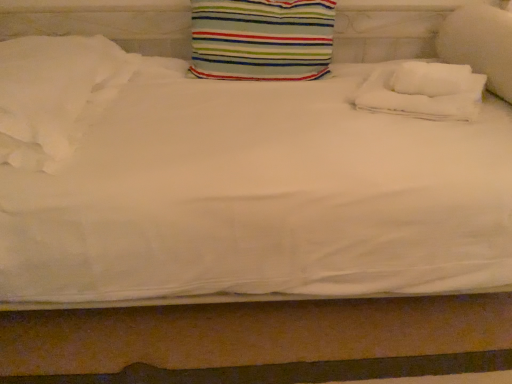
Question: Should I look upward or downward to see striped fabric pillow at center, the second pillow positioned from the left?

Choices:
 (A) down
 (B) up

Answer: (B)

Question: From the image's perspective, is white soft pillow at right, which is the 1th pillow in right-to-left order, located beneath white soft pillow at left, which is the fourth pillow in right-to-left order?

Choices:
 (A) yes
 (B) no

Answer: (B)

Question: Is white soft pillow at right, which is the 1th pillow in right-to-left order, closer to camera compared to white soft pillow at left, placed as the 1th pillow when sorted from left to right?

Choices:
 (A) no
 (B) yes

Answer: (A)

Question: Is white soft pillow at left, which is the fourth pillow in right-to-left order, inside white soft pillow at right, placed as the 4th pillow when sorted from left to right?

Choices:
 (A) yes
 (B) no

Answer: (B)

Question: Is white soft pillow at right, placed as the 4th pillow when sorted from left to right, positioned far away from white soft pillow at left, which is the fourth pillow in right-to-left order?

Choices:
 (A) no
 (B) yes

Answer: (B)

Question: Considering the relative sizes of white soft pillow at right, placed as the 4th pillow when sorted from left to right, and white soft pillow at left, placed as the 1th pillow when sorted from left to right, in the image provided, is white soft pillow at right, placed as the 4th pillow when sorted from left to right, bigger than white soft pillow at left, placed as the 1th pillow when sorted from left to right,?

Choices:
 (A) no
 (B) yes

Answer: (A)

Question: From a real-world perspective, is white soft pillow at right, placed as the 4th pillow when sorted from left to right, physically below white soft pillow at left, which is the fourth pillow in right-to-left order?

Choices:
 (A) no
 (B) yes

Answer: (A)

Question: From the image's perspective, is white soft pillow at left, which is the fourth pillow in right-to-left order, beneath white soft towel at upper right, the 3th pillow when ordered from left to right?

Choices:
 (A) yes
 (B) no

Answer: (A)

Question: Is white soft pillow at left, which is the fourth pillow in right-to-left order, not near white soft towel at upper right, the 3th pillow when ordered from left to right?

Choices:
 (A) yes
 (B) no

Answer: (B)

Question: Is white soft pillow at left, which is the fourth pillow in right-to-left order, next to white soft towel at upper right, the 3th pillow when ordered from left to right, and touching it?

Choices:
 (A) no
 (B) yes

Answer: (A)

Question: Can you confirm if white soft pillow at left, which is the fourth pillow in right-to-left order, is thinner than white soft towel at upper right, marked as the second pillow in a right-to-left arrangement?

Choices:
 (A) yes
 (B) no

Answer: (B)

Question: From a real-world perspective, is white soft pillow at left, which is the fourth pillow in right-to-left order, located beneath white soft towel at upper right, marked as the second pillow in a right-to-left arrangement?

Choices:
 (A) yes
 (B) no

Answer: (B)

Question: Considering the relative positions of white soft pillow at left, which is the fourth pillow in right-to-left order, and white soft towel at upper right, the 3th pillow when ordered from left to right, in the image provided, is white soft pillow at left, which is the fourth pillow in right-to-left order, behind white soft towel at upper right, the 3th pillow when ordered from left to right,?

Choices:
 (A) no
 (B) yes

Answer: (A)

Question: Is striped fabric pillow at center, the second pillow positioned from the left, wider than white soft towel at upper right, the 3th pillow when ordered from left to right?

Choices:
 (A) yes
 (B) no

Answer: (B)